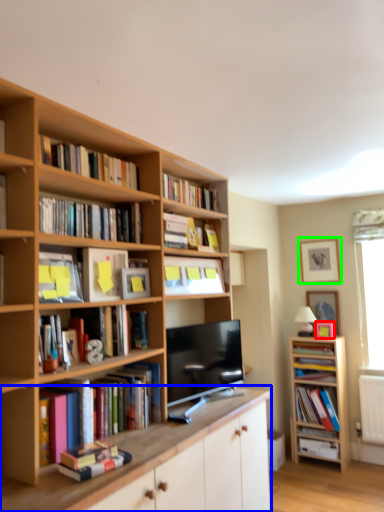
Question: Which object is positioned closest to picture frame (highlighted by a red box)? Select from cabinetry (highlighted by a blue box) and picture frame (highlighted by a green box).

Choices:
 (A) cabinetry
 (B) picture frame

Answer: (B)